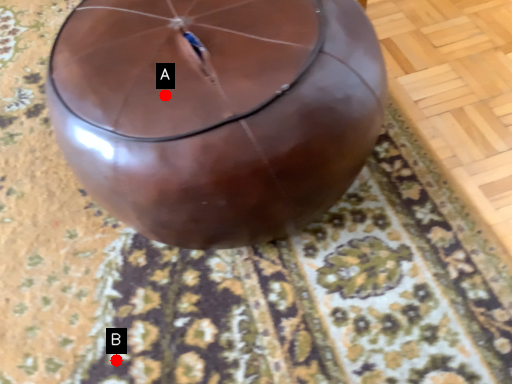
Question: Two points are circled on the image, labeled by A and B beside each circle. Which of the following is the farthest from the observer?

Choices:
 (A) A is further
 (B) B is further

Answer: (B)